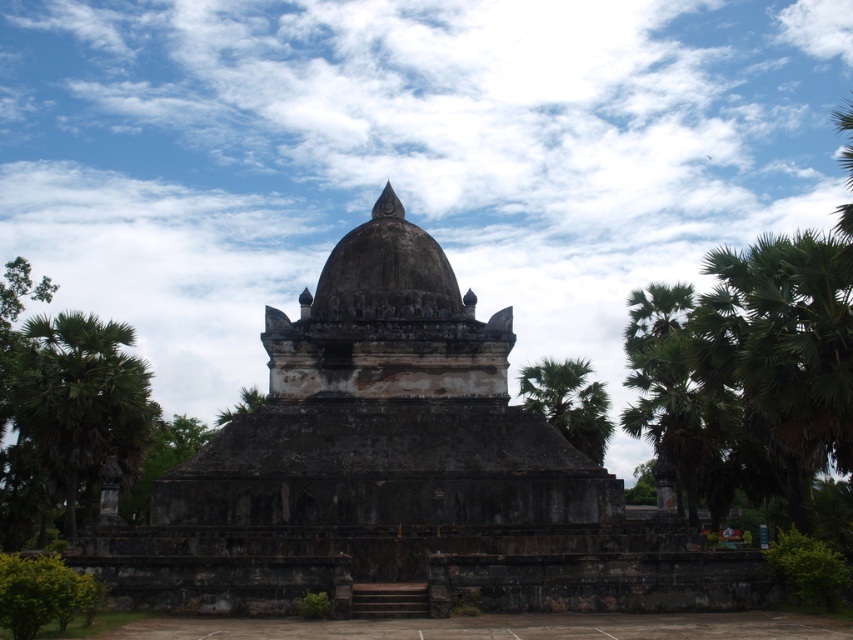
Question: Is dark stone temple at center further to the viewer compared to green leafy palm tree at left?

Choices:
 (A) no
 (B) yes

Answer: (A)

Question: Which point is farther to the camera?

Choices:
 (A) (590, 387)
 (B) (256, 493)

Answer: (A)

Question: Which point appears farthest from the camera in this image?

Choices:
 (A) (592, 419)
 (B) (347, 256)

Answer: (A)

Question: Which point is closer to the camera?

Choices:
 (A) dark stone temple at center
 (B) green leafy palm tree at right

Answer: (A)

Question: Is dark stone temple at center positioned behind green leafy palm tree at right?

Choices:
 (A) yes
 (B) no

Answer: (B)

Question: Does dark stone temple at center appear under green leafy palm tree at left?

Choices:
 (A) yes
 (B) no

Answer: (B)